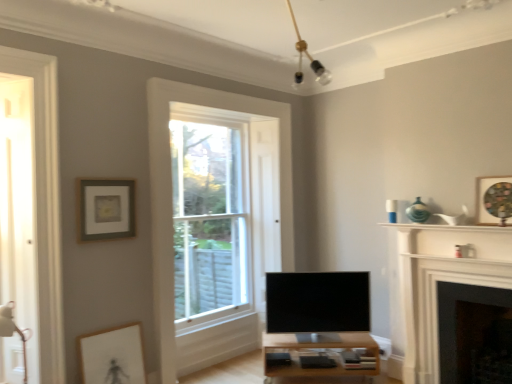
Find the location of a particular element. Image resolution: width=512 pixels, height=384 pixels. vacant location below silver metallic tv at center (from a real-world perspective) is located at coordinates (318, 343).